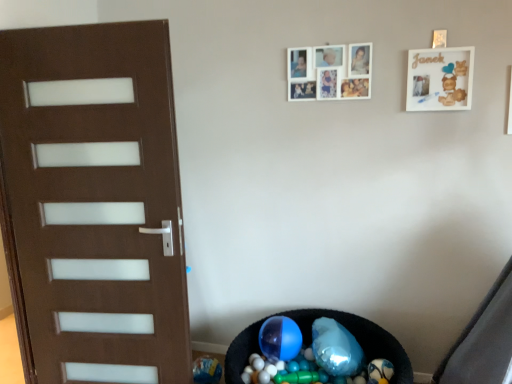
Question: From the image's perspective, is translucent plastic balls at lower center below white matte picture frame at upper center, acting as the second picture frame starting from the right?

Choices:
 (A) yes
 (B) no

Answer: (A)

Question: Is translucent plastic balls at lower center located outside white matte picture frame at upper center, acting as the second picture frame starting from the right?

Choices:
 (A) yes
 (B) no

Answer: (A)

Question: Does translucent plastic balls at lower center lie behind white matte picture frame at upper center, which is the first picture frame from left to right?

Choices:
 (A) yes
 (B) no

Answer: (B)

Question: Does translucent plastic balls at lower center touch white matte picture frame at upper center, acting as the second picture frame starting from the right?

Choices:
 (A) yes
 (B) no

Answer: (B)

Question: Considering the relative sizes of translucent plastic balls at lower center and white matte picture frame at upper center, which is the first picture frame from left to right, in the image provided, is translucent plastic balls at lower center bigger than white matte picture frame at upper center, which is the first picture frame from left to right,?

Choices:
 (A) yes
 (B) no

Answer: (A)

Question: From a real-world perspective, does translucent plastic balls at lower center stand above white matte picture frame at upper center, which is the first picture frame from left to right?

Choices:
 (A) no
 (B) yes

Answer: (A)

Question: Is translucent plastic balls at lower center bigger than white matte picture frame at upper right, which appears as the second picture frame when viewed from the left?

Choices:
 (A) no
 (B) yes

Answer: (B)

Question: Is translucent plastic balls at lower center turned away from white matte picture frame at upper right, which appears as the second picture frame when viewed from the left?

Choices:
 (A) yes
 (B) no

Answer: (B)

Question: Does translucent plastic balls at lower center touch white matte picture frame at upper right, the first picture frame viewed from the right?

Choices:
 (A) no
 (B) yes

Answer: (A)

Question: From a real-world perspective, is translucent plastic balls at lower center on top of white matte picture frame at upper right, which appears as the second picture frame when viewed from the left?

Choices:
 (A) no
 (B) yes

Answer: (A)

Question: Is the depth of translucent plastic balls at lower center less than that of white matte picture frame at upper right, the first picture frame viewed from the right?

Choices:
 (A) no
 (B) yes

Answer: (B)

Question: Considering the relative positions of translucent plastic balls at lower center and white matte picture frame at upper right, the first picture frame viewed from the right, in the image provided, is translucent plastic balls at lower center to the left of white matte picture frame at upper right, the first picture frame viewed from the right, from the viewer's perspective?

Choices:
 (A) no
 (B) yes

Answer: (B)

Question: Is white matte picture frame at upper center, which is the first picture frame from left to right, wider than white matte picture frame at upper right, which appears as the second picture frame when viewed from the left?

Choices:
 (A) no
 (B) yes

Answer: (A)